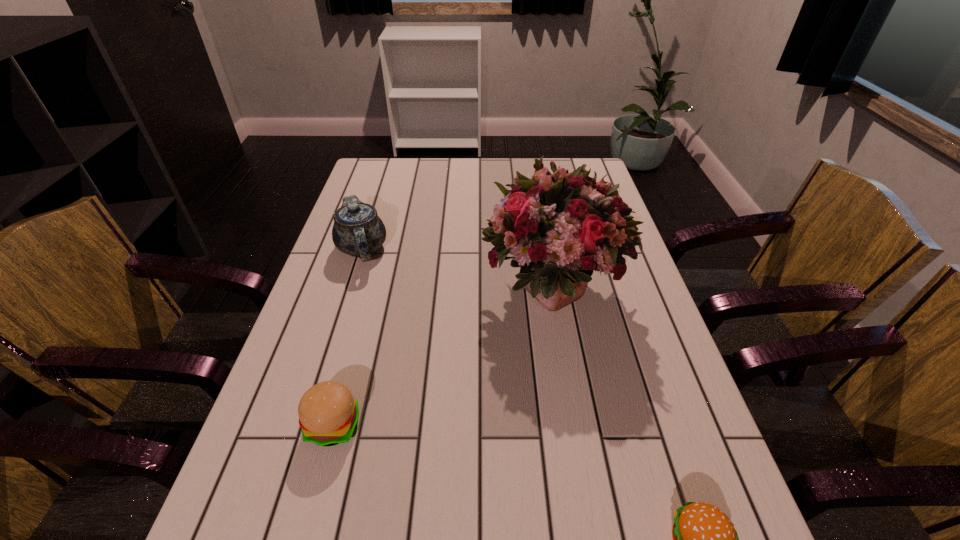
I want to click on object that is the second closest to the third farthest object, so click(358, 231).

Image resolution: width=960 pixels, height=540 pixels. I want to click on the second closest object relative to the farther hamburger, so click(358, 231).

Find the location of `free space that satisfies the following two spatial constraints: 1. from the spout of the chinaware; 2. on the left side of the tallest object`. free space that satisfies the following two spatial constraints: 1. from the spout of the chinaware; 2. on the left side of the tallest object is located at coordinates (349, 289).

The image size is (960, 540). I want to click on vacant region that satisfies the following two spatial constraints: 1. from the spout of the farther hamburger; 2. on the right side of the chinaware, so click(306, 424).

Locate an element on the screen. The width and height of the screenshot is (960, 540). vacant area in the image that satisfies the following two spatial constraints: 1. from the spout of the tallest object; 2. on the right side of the second tallest object is located at coordinates (349, 289).

Identify the location of free spot that satisfies the following two spatial constraints: 1. from the spout of the second nearest object; 2. on the right side of the second tallest object. [306, 424].

The width and height of the screenshot is (960, 540). Identify the location of vacant position in the image that satisfies the following two spatial constraints: 1. from the spout of the chinaware; 2. on the right side of the tallest object. (349, 289).

The width and height of the screenshot is (960, 540). I want to click on free location that satisfies the following two spatial constraints: 1. on the back side of the tallest object; 2. on the left side of the farther hamburger, so click(370, 289).

The image size is (960, 540). I want to click on free space that satisfies the following two spatial constraints: 1. from the spout of the left hamburger; 2. on the left side of the second tallest object, so click(x=306, y=424).